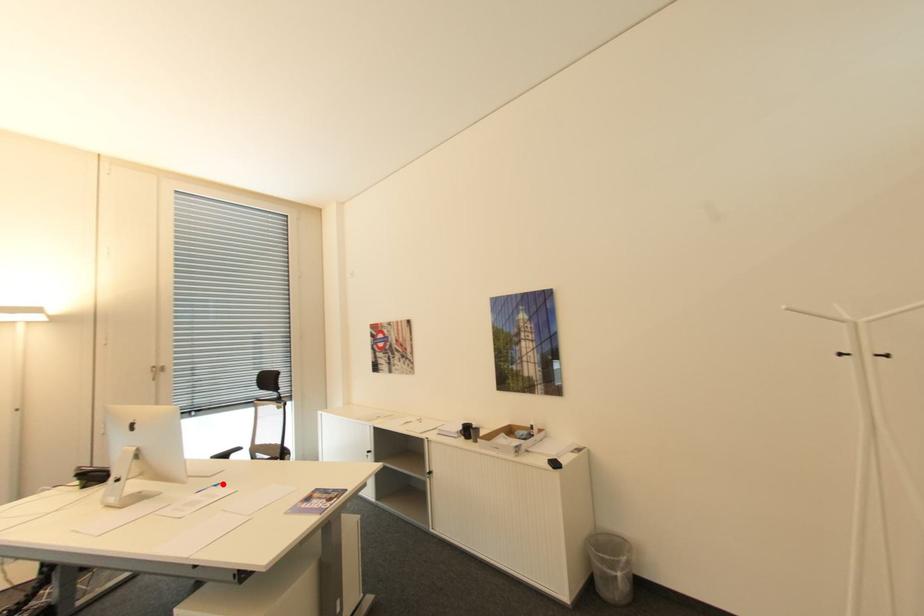
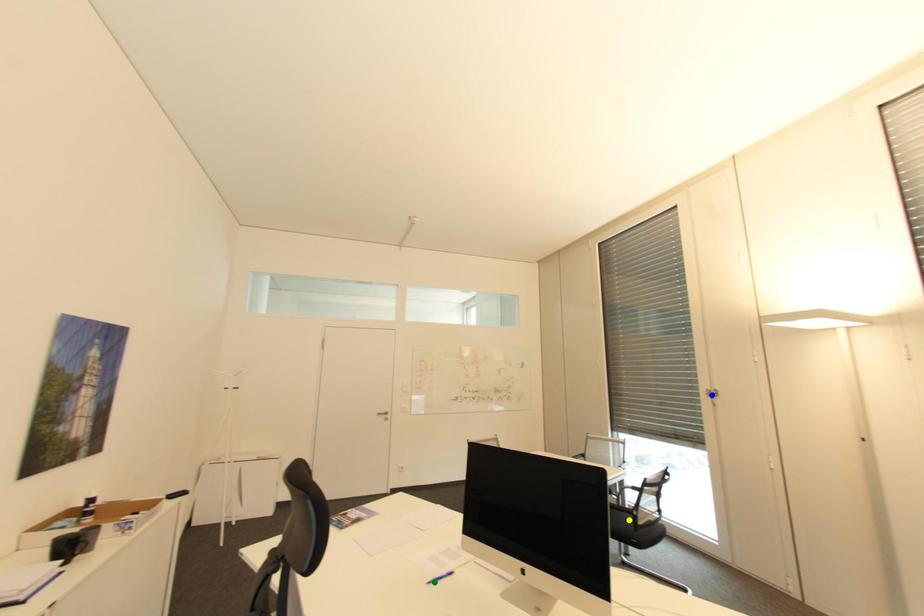
Question: I am providing you with two images of the same scene from different viewpoints. A red point is marked on the first image. You are given multiple points on the second image. Which mark in image 2 goes with the point in image 1?

Choices:
 (A) green point
 (B) yellow point
 (C) blue point

Answer: (A)